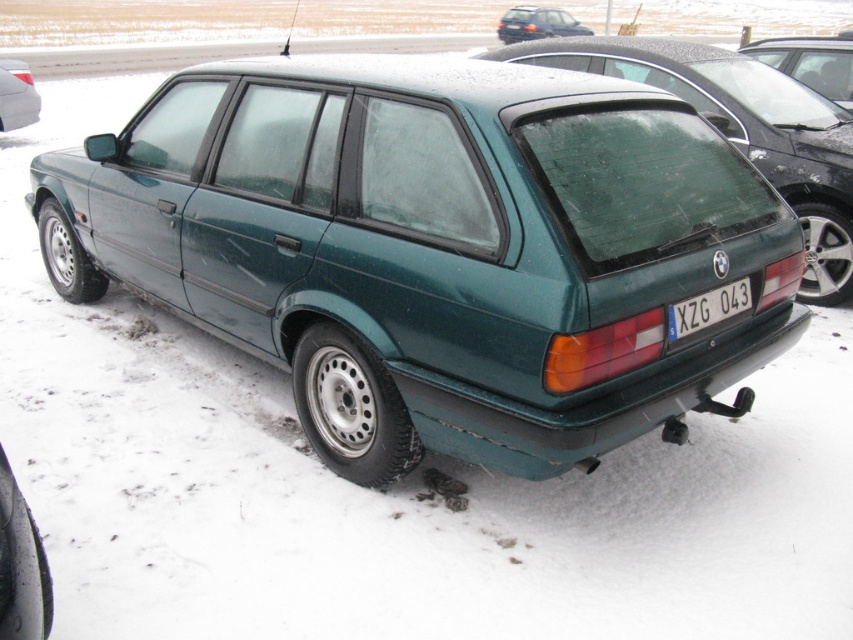
Does green matte hatchback at center come behind green matte station wagon at upper right?

No, green matte hatchback at center is closer to the viewer.

Measure the distance between point (766,116) and camera.

The distance of point (766,116) from camera is 5.60 meters.

Which is behind, point (834, 109) or point (788, 72)?

Point (788, 72)

This screenshot has height=640, width=853. Find the location of `green matte hatchback at center`. green matte hatchback at center is located at coordinates (741, 131).

Between green matte station wagon at upper right and blue metallic license plate at center, which one appears on the left side from the viewer's perspective?

From the viewer's perspective, blue metallic license plate at center appears more on the left side.

Is point (782, 58) positioned before point (676, 326)?

No, (782, 58) is further to viewer.

Find the location of `green matte station wagon at upper right`. green matte station wagon at upper right is located at coordinates (811, 61).

Is metallic green car at center above metallic green wagon at upper center?

Incorrect, metallic green car at center is not positioned above metallic green wagon at upper center.

Measure the distance between metallic green car at center and metallic green wagon at upper center.

They are 27.32 meters apart.

The height and width of the screenshot is (640, 853). I want to click on metallic green car at center, so click(x=437, y=250).

I want to click on metallic green car at center, so click(437, 250).